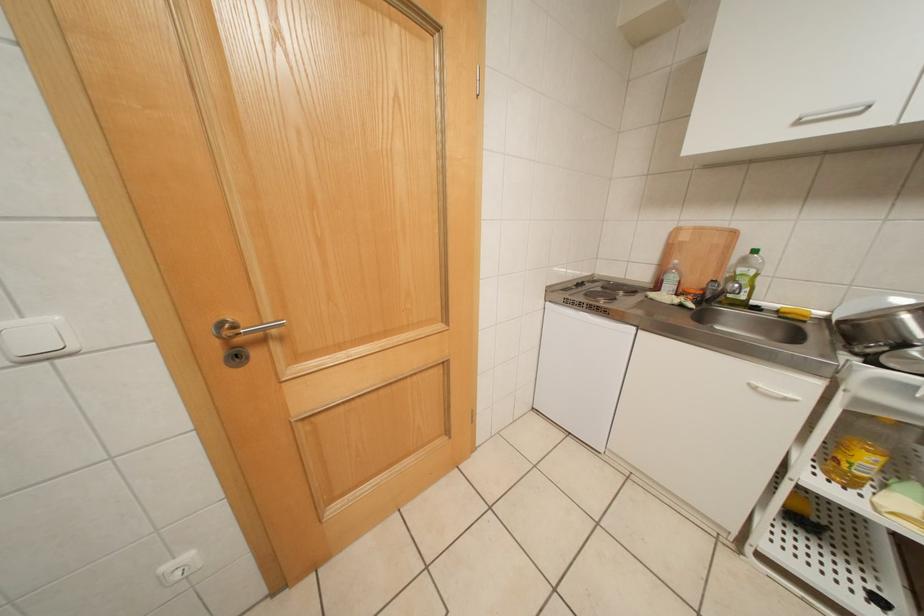
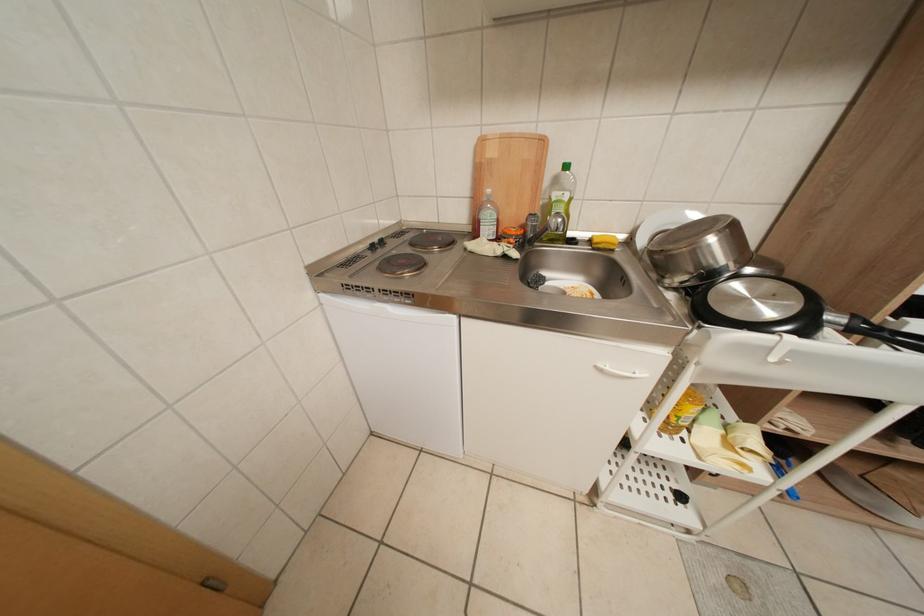
The images are taken continuously from a first-person perspective. In which direction is your viewpoint rotating?

The rotation direction of the camera is right-down.